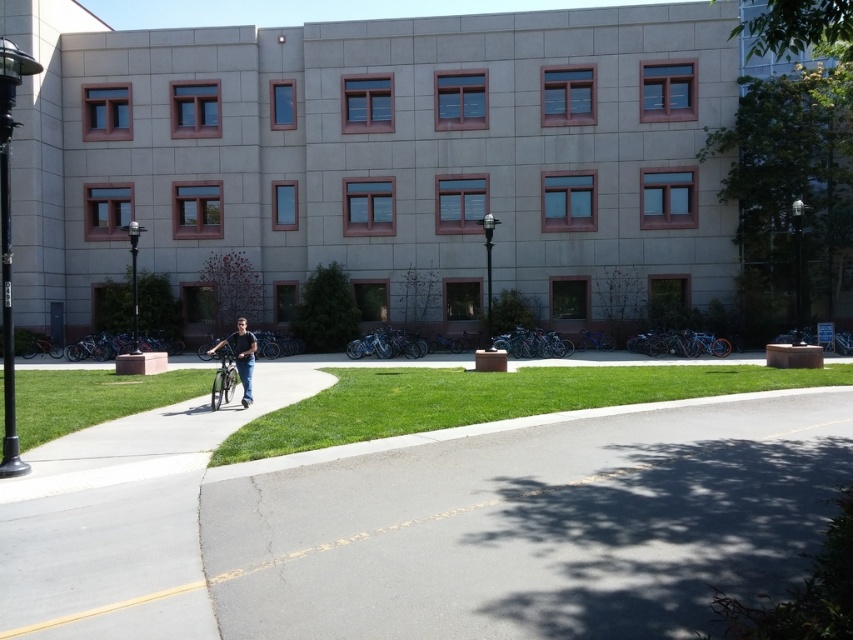
Based on the photo, you are standing at the point with coordinates 0.7, 0.6. You want to walk to the gray asphalt road at lower center. In which direction should you move?

The gray asphalt road at lower center is located at point [531,525]. Since you are at [511,448], you should move northeast to reach it.